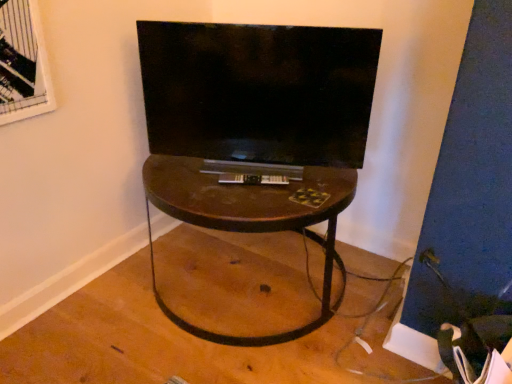
What do you see at coordinates (249, 220) in the screenshot? Image resolution: width=512 pixels, height=384 pixels. I see `brown wood table at center` at bounding box center [249, 220].

The image size is (512, 384). Describe the element at coordinates (258, 94) in the screenshot. I see `matte black tv at center` at that location.

Locate an element on the screen. The image size is (512, 384). brown wood table at center is located at coordinates (249, 220).

Measure the distance between brown wood table at center and matte black tv at center.

brown wood table at center and matte black tv at center are 9.24 inches apart from each other.

Which object is further away from the camera taking this photo, brown wood table at center or matte black tv at center?

matte black tv at center is further away from the camera.

From a real-world perspective, does brown wood table at center sit lower than matte black tv at center?

Yes, from a real-world perspective, brown wood table at center is below matte black tv at center.

From the image's perspective, between brown wood table at center and matte black tv at center, who is located below?

brown wood table at center appears lower in the image.

Which object is further away from the camera, matte black tv at center or brown wood table at center?

matte black tv at center is behind.

Is matte black tv at center surrounding brown wood table at center?

No, brown wood table at center is not inside matte black tv at center.

Based on the photo, from the image's perspective, is matte black tv at center above or below brown wood table at center?

matte black tv at center is above brown wood table at center.

Is velvet black swivel chair at lower right positioned before brown wood table at center?

Yes, the depth of velvet black swivel chair at lower right is less than that of brown wood table at center.

Which of these two, velvet black swivel chair at lower right or brown wood table at center, is thinner?

velvet black swivel chair at lower right is thinner.

From a real-world perspective, between velvet black swivel chair at lower right and brown wood table at center, who is vertically lower?

velvet black swivel chair at lower right, from a real-world perspective.

Considering the positions of objects velvet black swivel chair at lower right and brown wood table at center in the image provided, who is more to the left, velvet black swivel chair at lower right or brown wood table at center?

Positioned to the left is brown wood table at center.

Which is more to the left, velvet black swivel chair at lower right or matte black tv at center?

matte black tv at center is more to the left.

Considering the sizes of objects velvet black swivel chair at lower right and matte black tv at center in the image provided, who is shorter, velvet black swivel chair at lower right or matte black tv at center?

velvet black swivel chair at lower right.

Could you tell me if velvet black swivel chair at lower right is facing matte black tv at center?

No, velvet black swivel chair at lower right does not turn towards matte black tv at center.

Which is closer, (482, 337) or (183, 47)?

Point (482, 337).

Based on the photo, is matte black tv at center oriented towards velvet black swivel chair at lower right?

No.

From the image's perspective, which is above, matte black tv at center or velvet black swivel chair at lower right?

matte black tv at center.

Would you say matte black tv at center is a long distance from velvet black swivel chair at lower right?

No, there isn't a large distance between matte black tv at center and velvet black swivel chair at lower right.

Is the position of matte black tv at center less distant than that of velvet black swivel chair at lower right?

That is False.

Is brown wood table at center directly adjacent to velvet black swivel chair at lower right?

No, brown wood table at center is not making contact with velvet black swivel chair at lower right.

Looking at this image, is brown wood table at center to the right of velvet black swivel chair at lower right from the viewer's perspective?

No, brown wood table at center is not to the right of velvet black swivel chair at lower right.

Is brown wood table at center looking in the opposite direction of velvet black swivel chair at lower right?

No, brown wood table at center is not facing away from velvet black swivel chair at lower right.

From a real-world perspective, is brown wood table at center above or below velvet black swivel chair at lower right?

From a real-world perspective, brown wood table at center is physically above velvet black swivel chair at lower right.

Identify the location of table that appears on the left of matte black tv at center. Image resolution: width=512 pixels, height=384 pixels. (249, 220).

Identify the location of table below the matte black tv at center (from the image's perspective). The width and height of the screenshot is (512, 384). (x=249, y=220).

Consider the image. Looking at the image, which one is located closer to velvet black swivel chair at lower right, brown wood table at center or matte black tv at center?

brown wood table at center lies closer to velvet black swivel chair at lower right than the other object.

When comparing their distances from brown wood table at center, does matte black tv at center or velvet black swivel chair at lower right seem further?

The object further to brown wood table at center is velvet black swivel chair at lower right.

Based on their spatial positions, is velvet black swivel chair at lower right or brown wood table at center further from matte black tv at center?

velvet black swivel chair at lower right is further to matte black tv at center.

From the picture: When comparing their distances from matte black tv at center, does brown wood table at center or velvet black swivel chair at lower right seem closer?

brown wood table at center is closer to matte black tv at center.

From the picture: From the image, which object appears to be nearer to velvet black swivel chair at lower right, matte black tv at center or brown wood table at center?

Among the two, brown wood table at center is located nearer to velvet black swivel chair at lower right.

Based on their spatial positions, is velvet black swivel chair at lower right or matte black tv at center further from brown wood table at center?

velvet black swivel chair at lower right is positioned further to the anchor brown wood table at center.

At what (x,y) coordinates should I click in order to perform the action: click on table between matte black tv at center and velvet black swivel chair at lower right in the up-down direction. Please return your answer as a coordinate pair (x, y). The width and height of the screenshot is (512, 384). Looking at the image, I should click on (249, 220).